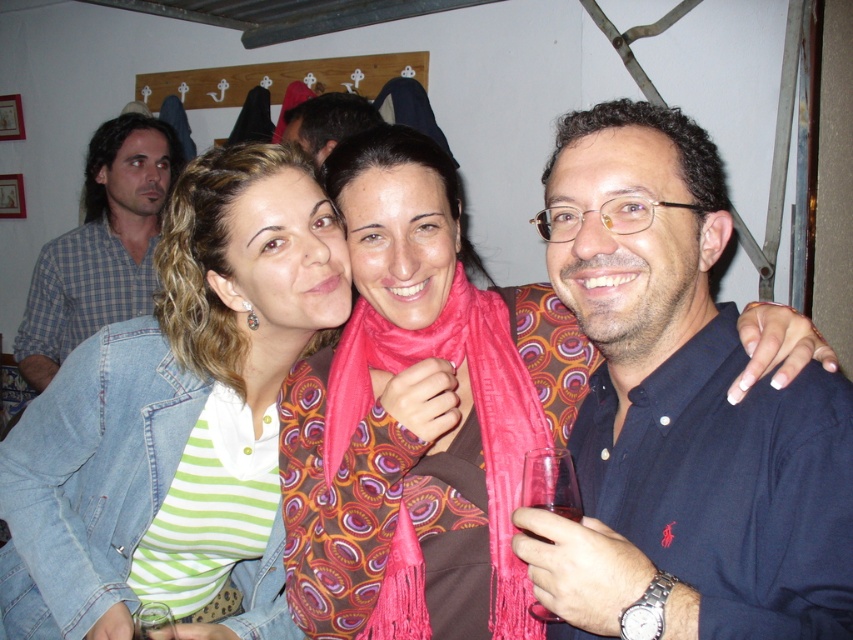
You are a photographer trying to adjust the lighting for a group photo. You notice the dark blue shirt at right and the dark brown hair at center. Which object should you focus on first to ensure proper exposure, considering their positions?

The dark blue shirt at right is closer to the viewer than the dark brown hair at center, so you should focus on the dark blue shirt at right first to ensure proper exposure.

From the picture: You are standing in the room and want to know the position of the blue plaid shirt at upper left relative to the other objects. Can you determine if it is to the left or right of the center of the image?

The blue plaid shirt at upper left is located at point (100, 244), which places it to the left side of the image compared to the center.

Consider the image. You are a photographer trying to capture a group shot of the three people in the scene. You want to ensure that the pink woven scarf at center and the dark brown hair at center are both clearly visible in the photo. Based on their distance, do you think the current positioning allows for both to be in focus simultaneously?

The pink woven scarf at center is 1.33 meters from the dark brown hair at center. Since they are positioned at this distance apart, it is likely that both can be in focus simultaneously in the photo, provided the camera is set with an appropriate aperture for the depth of field required.